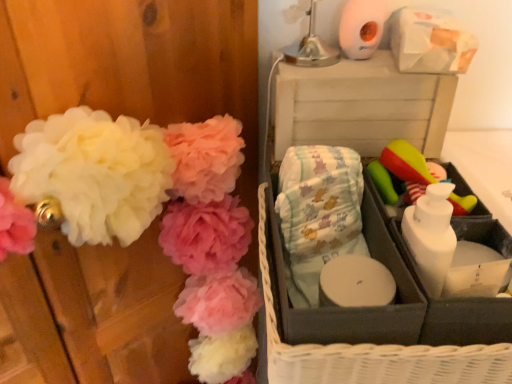
Question: Relative to white plastic storage box at upper right, is white fluffy pom-poms at left in front or behind?

Choices:
 (A) behind
 (B) front

Answer: (B)

Question: Considering the positions of white fluffy pom-poms at left and white plastic storage box at upper right in the image, is white fluffy pom-poms at left wider or thinner than white plastic storage box at upper right?

Choices:
 (A) wide
 (B) thin

Answer: (B)

Question: Based on their relative distances, which object is nearer to the light blue fabric diapers at center?

Choices:
 (A) white plastic storage box at upper right
 (B) gray fabric basket at right
 (C) white fluffy pom-poms at left
 (D) white matte toilet paper at upper right
 (E) green rubber brush at right

Answer: (B)

Question: Considering the real-world distances, which object is closest to the green rubber brush at right?

Choices:
 (A) white plastic storage box at upper right
 (B) white fluffy pom-poms at left
 (C) white matte toilet paper at upper right
 (D) light blue fabric diapers at center
 (E) gray fabric basket at right

Answer: (A)